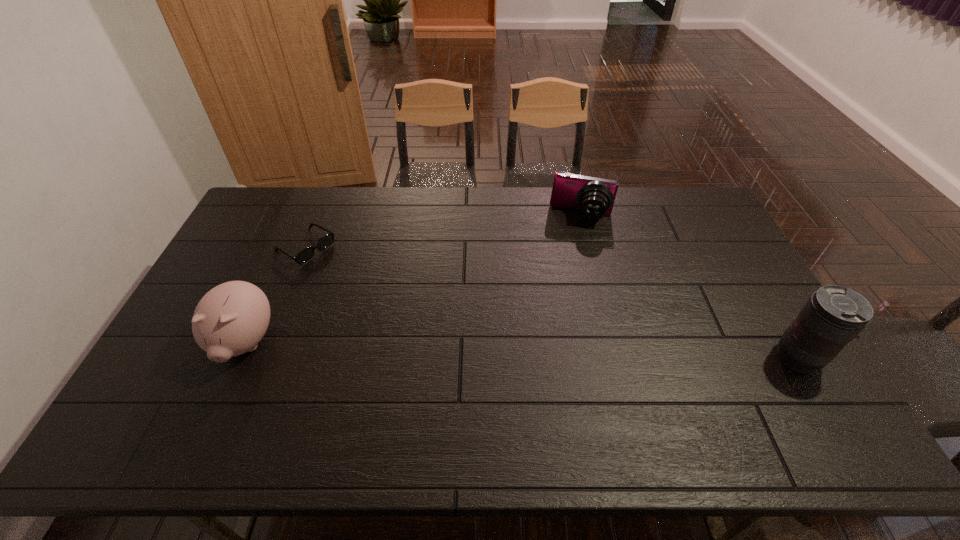
Find the location of a particular element. The image size is (960, 540). vacant space positioned 0.140m on the front-facing side of the sunglasses is located at coordinates (354, 278).

Find the location of a particular element. The width and height of the screenshot is (960, 540). free space located 0.130m on the front-facing side of the sunglasses is located at coordinates coord(352,276).

The height and width of the screenshot is (540, 960). In order to click on free spot located on the front-facing side of the sunglasses in this screenshot , I will do `click(344, 271)`.

I want to click on vacant space located on the front-facing side of the second object from right to left, so click(x=566, y=286).

Locate an element on the screen. vacant area situated on the front-facing side of the second object from right to left is located at coordinates (571, 258).

This screenshot has width=960, height=540. I want to click on vacant space located 0.300m on the front-facing side of the second object from right to left, so click(565, 290).

The width and height of the screenshot is (960, 540). Find the location of `object located in the far edge section of the desktop`. object located in the far edge section of the desktop is located at coordinates (593, 196).

The width and height of the screenshot is (960, 540). I want to click on piggy bank present at the near edge, so click(230, 319).

At what (x,y) coordinates should I click in order to perform the action: click on telephoto lens situated at the near edge. Please return your answer as a coordinate pair (x, y). Looking at the image, I should click on (833, 316).

Image resolution: width=960 pixels, height=540 pixels. I want to click on piggy bank located at the left edge, so point(230,319).